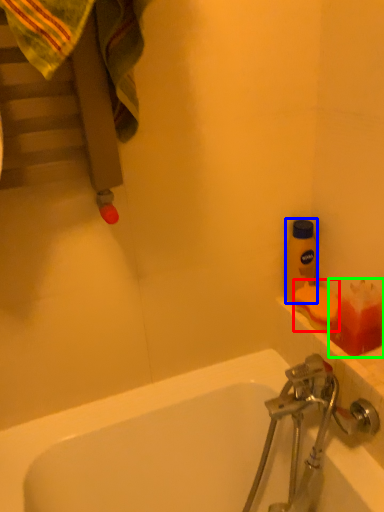
Question: Which object is the farthest from soap (highlighted by a red box)? Choose among these: bottle (highlighted by a blue box) or toiletry (highlighted by a green box).

Choices:
 (A) bottle
 (B) toiletry

Answer: (A)